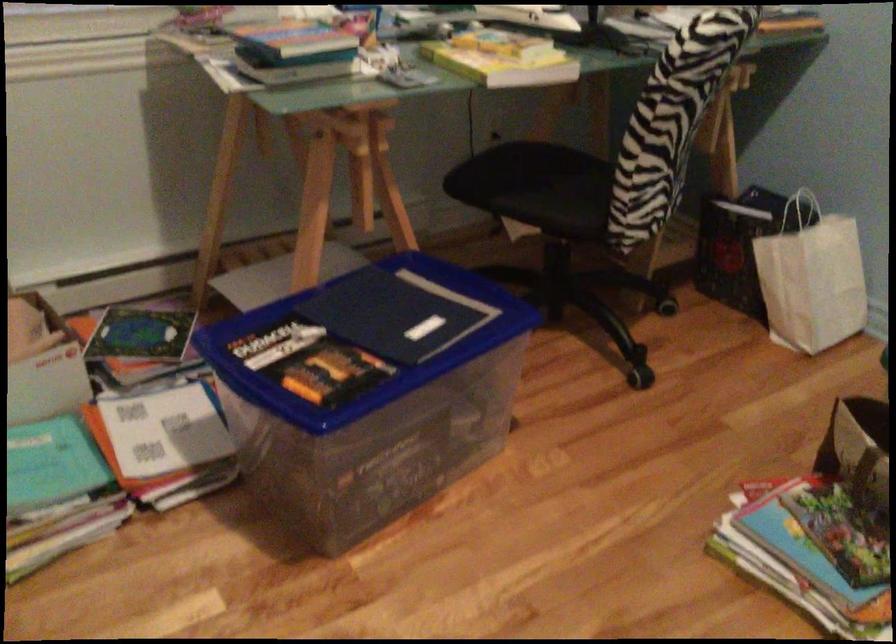
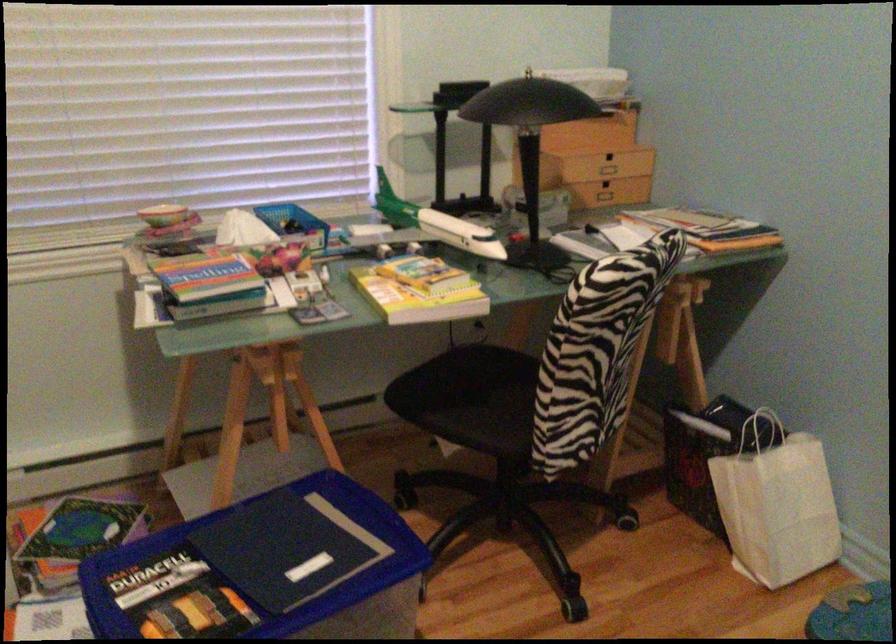
Locate, in the second image, the point that corresponds to the point at 797,214 in the first image.

(761, 431)